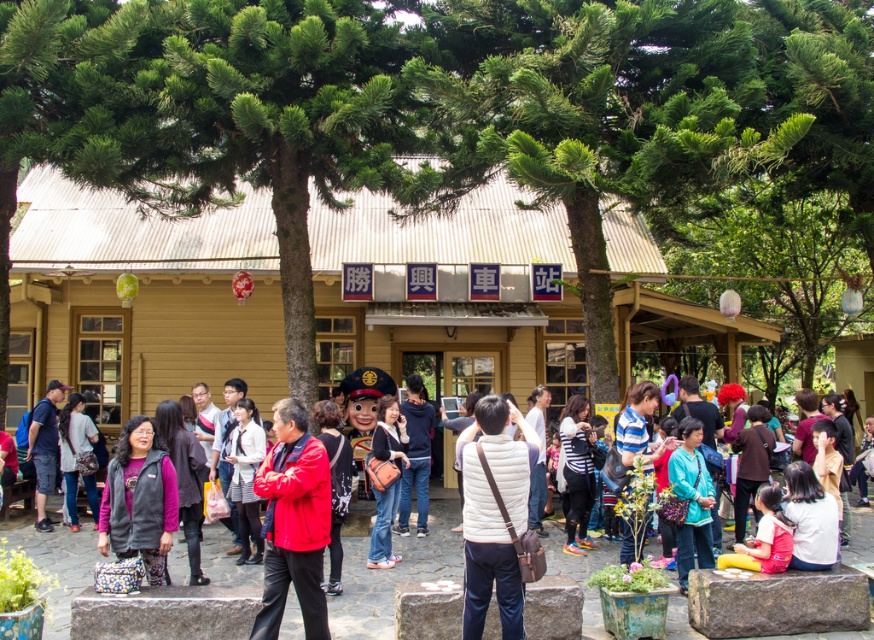
Question: Is green textured tree at center above striped fabric shirt at center?

Choices:
 (A) no
 (B) yes

Answer: (B)

Question: Is striped fabric shirt at center wider than matte black jacket at left?

Choices:
 (A) no
 (B) yes

Answer: (A)

Question: Which point appears closest to the camera in this image?

Choices:
 (A) (399, 420)
 (B) (633, 449)
 (C) (414, 456)

Answer: (B)

Question: Can you confirm if matte black jacket at center is bigger than blue fabric bag at center?

Choices:
 (A) no
 (B) yes

Answer: (B)

Question: Which point is closer to the camera taking this photo?

Choices:
 (A) pyautogui.click(x=38, y=433)
 (B) pyautogui.click(x=649, y=435)

Answer: (B)

Question: Which of the following is the closest to the observer?

Choices:
 (A) (385, 554)
 (B) (681, 576)
 (C) (47, 448)

Answer: (B)